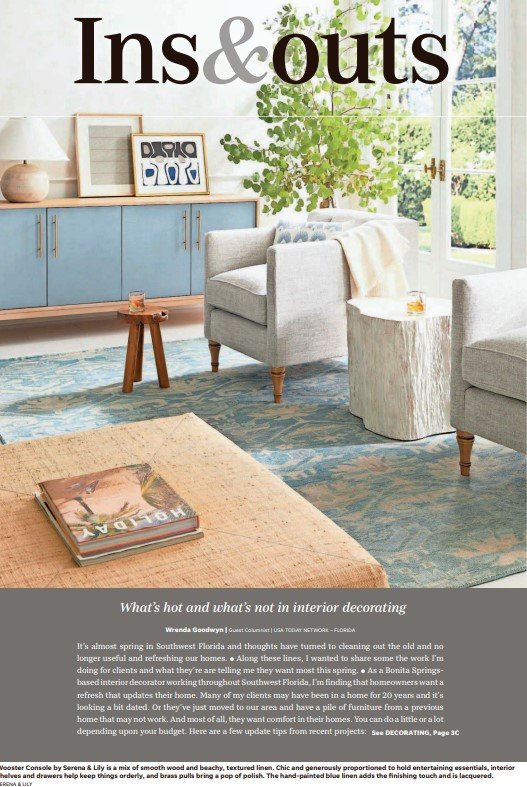
I want to click on framed pictures, so click(x=161, y=159), click(x=104, y=153).